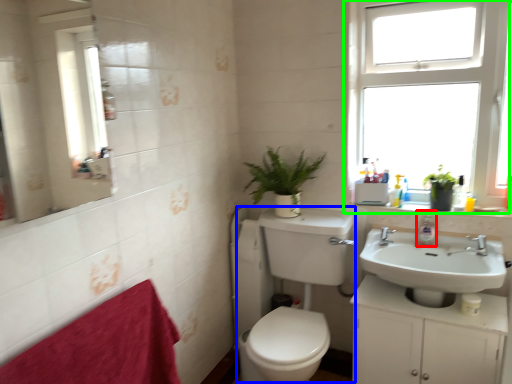
Question: Which is farther away from soap dispenser (highlighted by a red box)? sink (highlighted by a blue box) or window (highlighted by a green box)?

Choices:
 (A) sink
 (B) window

Answer: (B)